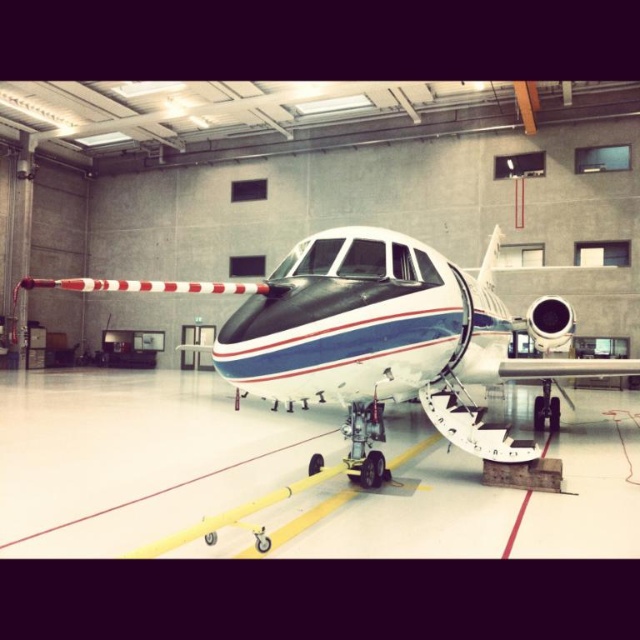
Question: Is white glossy tarmac at center above white glossy airplane at center?

Choices:
 (A) no
 (B) yes

Answer: (A)

Question: Can you confirm if white glossy tarmac at center is wider than white glossy airplane at center?

Choices:
 (A) yes
 (B) no

Answer: (A)

Question: Considering the relative positions of white glossy tarmac at center and white glossy airplane at center in the image provided, where is white glossy tarmac at center located with respect to white glossy airplane at center?

Choices:
 (A) right
 (B) left

Answer: (B)

Question: Which of the following is the closest to the observer?

Choices:
 (A) white glossy tarmac at center
 (B) white glossy airplane at center

Answer: (B)

Question: Which object is closer to the camera taking this photo?

Choices:
 (A) white glossy tarmac at center
 (B) white glossy airplane at center

Answer: (B)